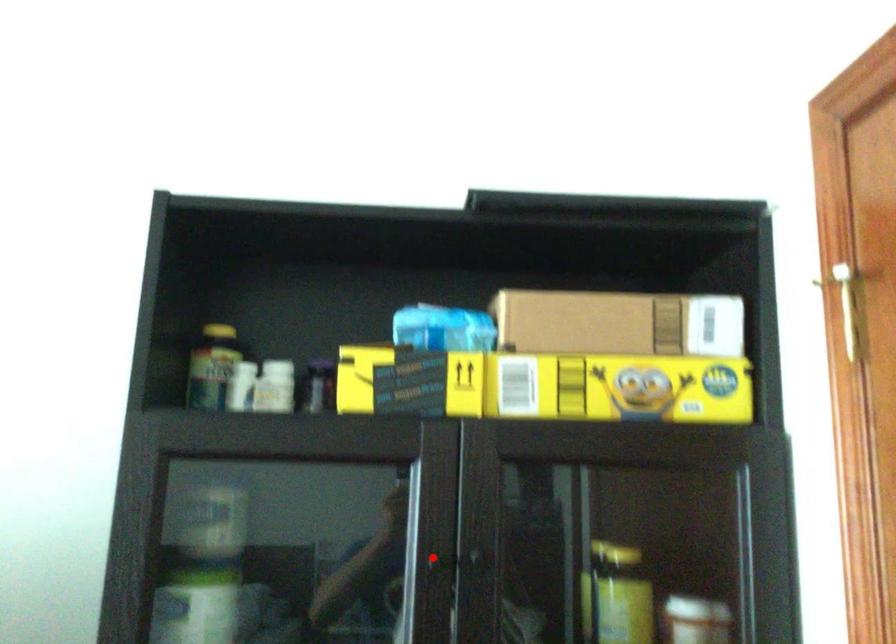
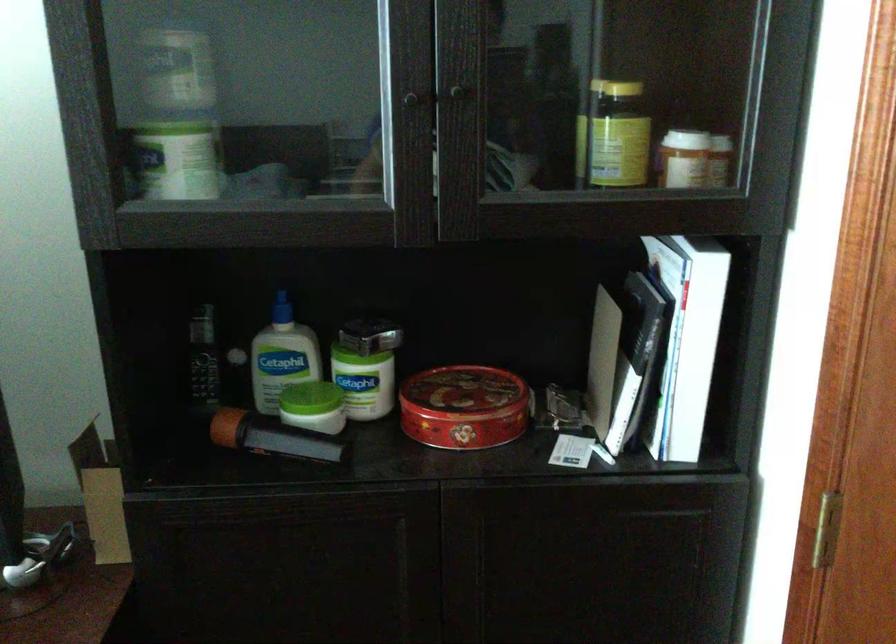
Question: I am providing you with two images of the same scene from different viewpoints. A red point is shown in image1. For the corresponding object point in image2, is it positioned nearer or farther from the camera?

Choices:
 (A) Nearer
 (B) Farther

Answer: (A)